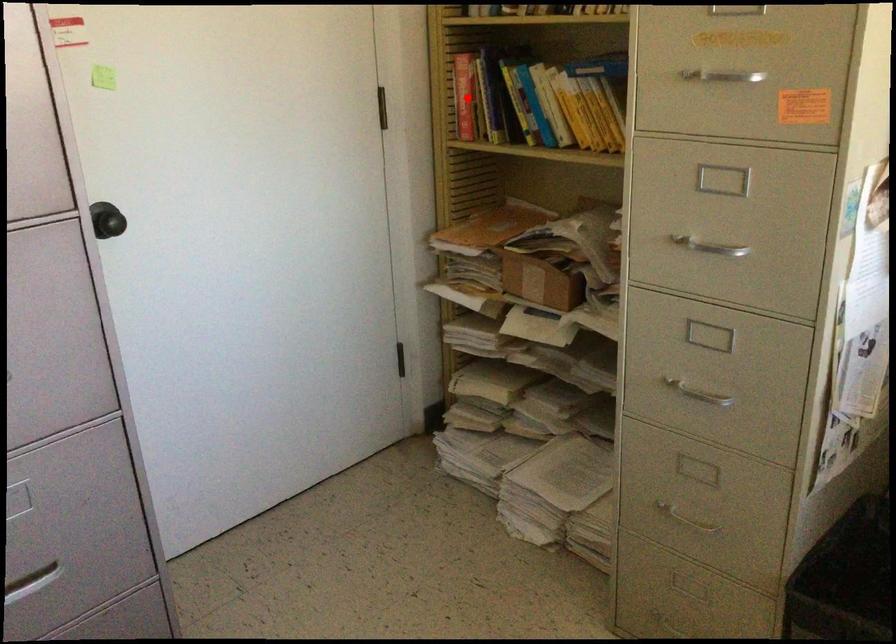
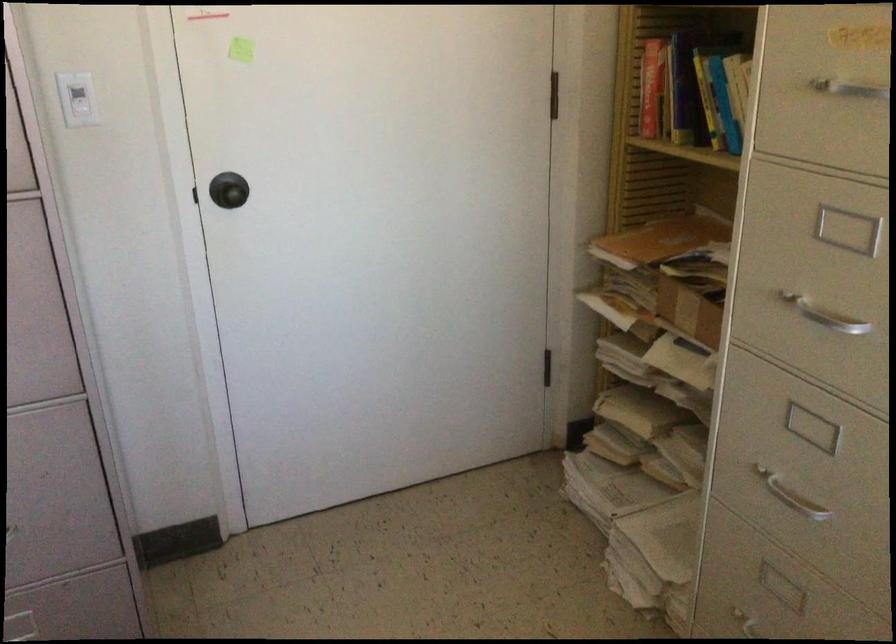
Question: I am providing you with two images of the same scene from different viewpoints. Image1 has a red point marked. In image2, the corresponding 3D location appears at what relative position? Reply with the corresponding letter.

Choices:
 (A) Closer
 (B) Farther

Answer: (A)